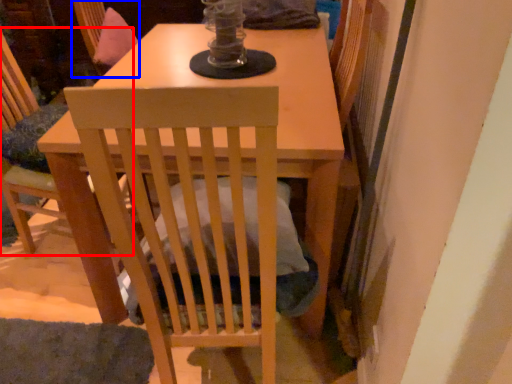
Question: Which point is closer to the camera, chair (highlighted by a red box) or swivel chair (highlighted by a blue box)?

Choices:
 (A) chair
 (B) swivel chair

Answer: (A)